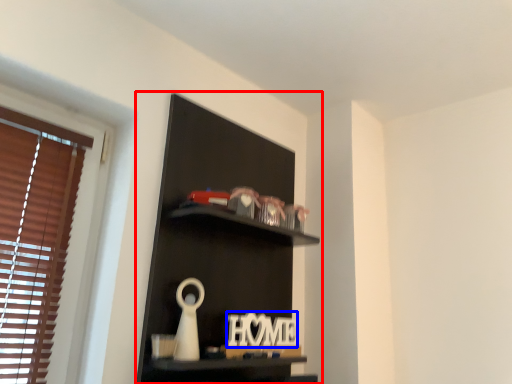
Question: Among these objects, which one is nearest to the camera, shelf (highlighted by a red box) or letter (highlighted by a blue box)?

Choices:
 (A) shelf
 (B) letter

Answer: (A)